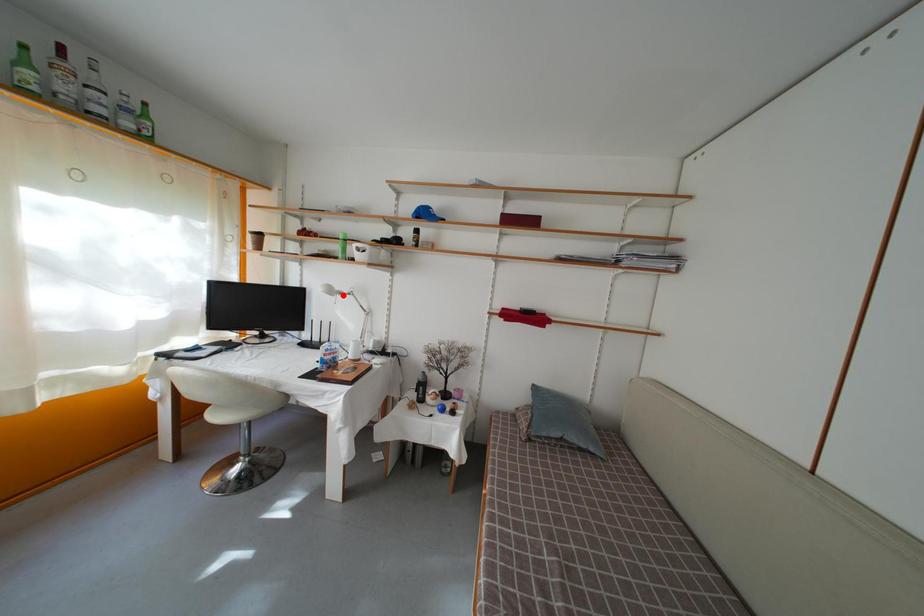
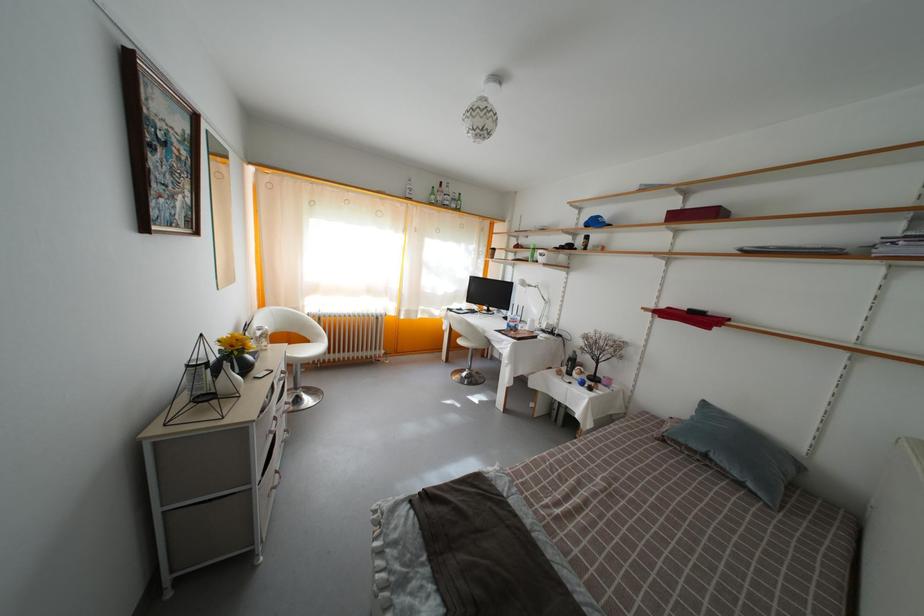
Where in the second image is the point corresponding to the highlighted location from the first image?

(533, 289)